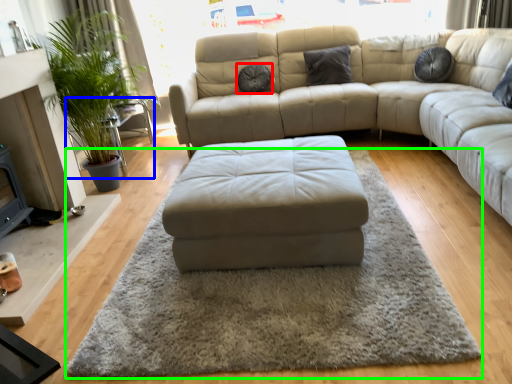
Question: Estimate the real-world distances between objects in this image. Which object is closer to pillow (highlighted by a red box), side table (highlighted by a blue box) or mat (highlighted by a green box)?

Choices:
 (A) side table
 (B) mat

Answer: (A)